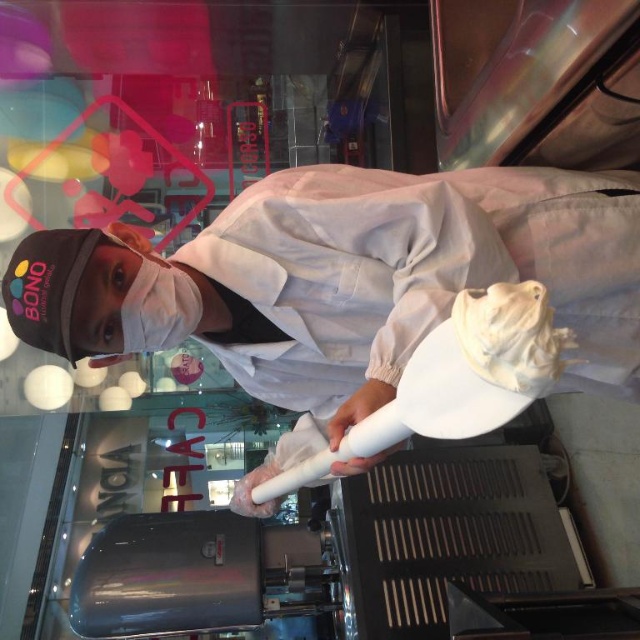
This screenshot has height=640, width=640. Describe the element at coordinates (344, 284) in the screenshot. I see `white matte baseball cap at upper center` at that location.

Can you confirm if white matte baseball cap at upper center is taller than white fluffy cream at center?

Yes.

Which is in front, point (355, 289) or point (561, 365)?

Point (561, 365) is more forward.

Image resolution: width=640 pixels, height=640 pixels. Identify the location of white matte baseball cap at upper center. (344, 284).